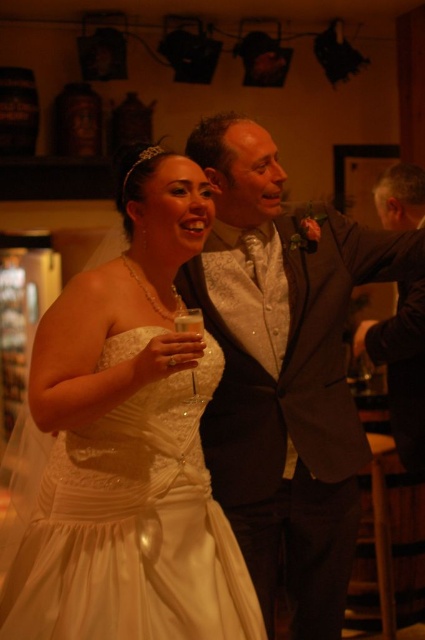
Question: Which object is the farthest from the dark brown suit at right?

Choices:
 (A) shiny silver vest at center
 (B) ivory satin dress at center

Answer: (B)

Question: Which of the following is the closest to the observer?

Choices:
 (A) shiny silver vest at center
 (B) dark brown suit at right
 (C) clear glass wine glass at center

Answer: (C)

Question: Where is shiny silver vest at center located in relation to dark brown suit at right in the image?

Choices:
 (A) below
 (B) above

Answer: (B)

Question: Is shiny silver vest at center to the right of clear glass wine glass at center from the viewer's perspective?

Choices:
 (A) yes
 (B) no

Answer: (A)

Question: Which object appears closest to the camera in this image?

Choices:
 (A) dark brown suit at right
 (B) ivory satin dress at center

Answer: (B)

Question: Is the position of ivory satin dress at center more distant than that of clear glass wine glass at center?

Choices:
 (A) no
 (B) yes

Answer: (A)